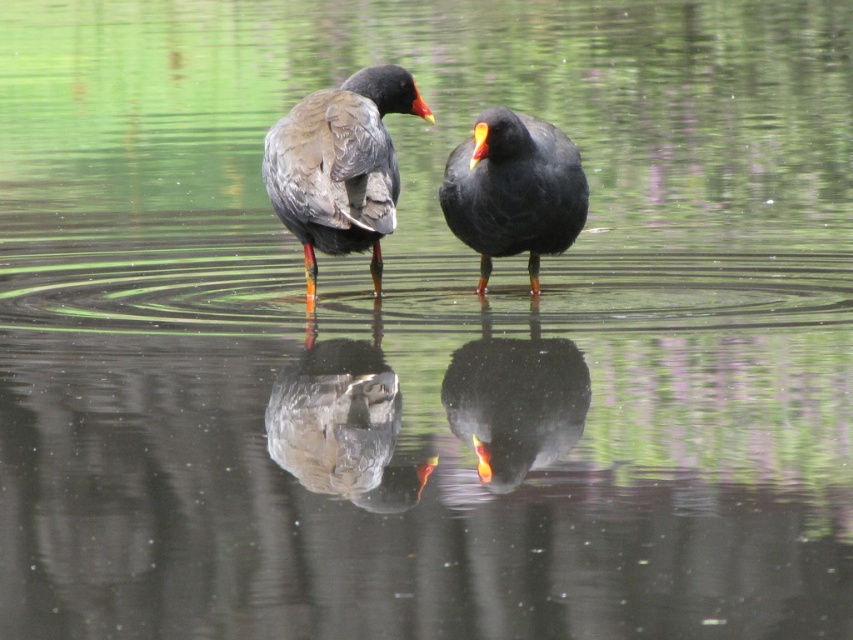
Does matte black duck at center appear under shiny black bird at center?

Incorrect, matte black duck at center is not positioned below shiny black bird at center.

Which is in front, point (503, 200) or point (573, 369)?

Point (503, 200) is more forward.

What are the coordinates of `matte black duck at center` in the screenshot? It's located at (514, 189).

Does matte gray bird at center have a lesser width compared to shiny black bird at center?

In fact, matte gray bird at center might be wider than shiny black bird at center.

Is matte gray bird at center taller than shiny black bird at center?

Yes.

Between point (454, 413) and point (514, 392), which one is positioned in front?

Point (454, 413)

This screenshot has height=640, width=853. Find the location of `matte gray bird at center`. matte gray bird at center is located at coordinates (343, 426).

Who is more distant from viewer, (381, 456) or (460, 234)?

Positioned behind is point (460, 234).

Which is behind, point (500, 460) or point (549, 125)?

Point (549, 125)

At what (x,y) coordinates should I click in order to perform the action: click on matte gray bird at center. Please return your answer as a coordinate pair (x, y). This screenshot has width=853, height=640. Looking at the image, I should click on (343, 426).